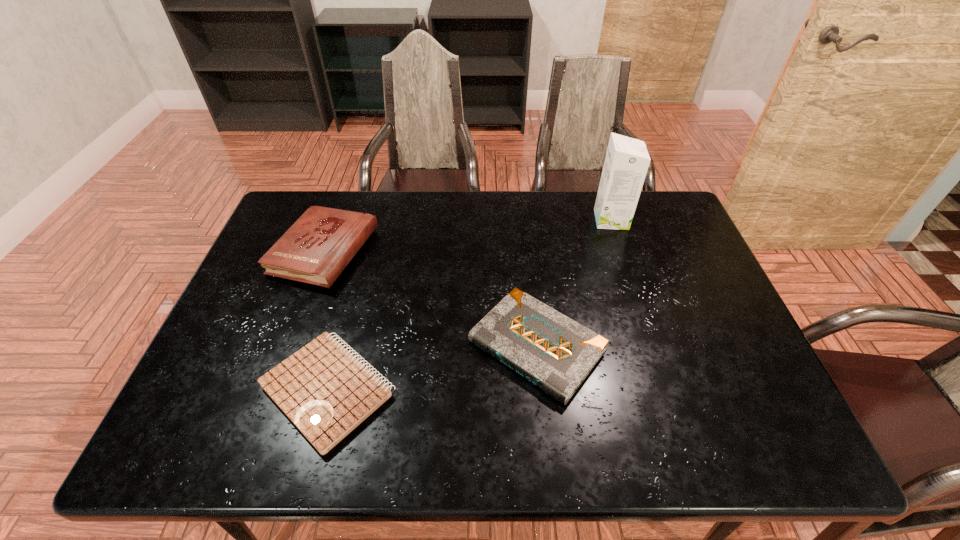
Identify the location of the tallest object. The height and width of the screenshot is (540, 960). (627, 160).

Where is `the rightmost object`? Image resolution: width=960 pixels, height=540 pixels. the rightmost object is located at coordinates (627, 160).

Locate an element on the screen. hardback book is located at coordinates (316, 249).

Where is `the right notebook`? The height and width of the screenshot is (540, 960). the right notebook is located at coordinates (554, 352).

Where is `the second shortest object`? This screenshot has width=960, height=540. the second shortest object is located at coordinates (554, 352).

You are a GUI agent. You are given a task and a screenshot of the screen. Output one action in this format:
    pyautogui.click(x=<x>, y=<y>)
    Task: Click on the left notebook
    The image size is (960, 540).
    Given the screenshot: What is the action you would take?
    pyautogui.click(x=324, y=390)

Locate an element on the screen. The width and height of the screenshot is (960, 540). the shortest object is located at coordinates (324, 390).

At what (x,y) coordinates should I click in order to perform the action: click on vacant space located on the front of the tallest object. Please return your answer as a coordinate pair (x, y). The image size is (960, 540). Looking at the image, I should click on (639, 307).

The width and height of the screenshot is (960, 540). What are the coordinates of `free location located 0.160m on the front of the hardback book` in the screenshot? It's located at (293, 340).

In order to click on vacant space situated on the right of the right notebook in this screenshot , I will do `click(634, 346)`.